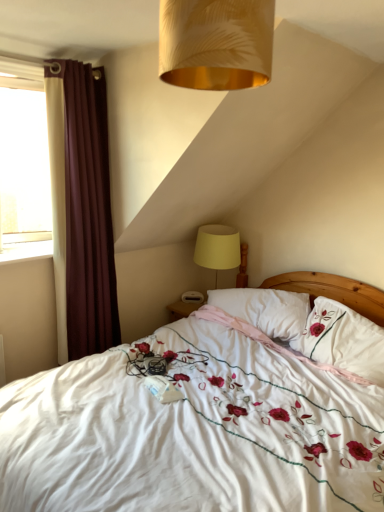
Question: From a real-world perspective, is yellow fabric lampshade at upper right positioned over white glossy window sill at left based on gravity?

Choices:
 (A) no
 (B) yes

Answer: (A)

Question: Is white glossy window sill at left surrounded by yellow fabric lampshade at upper right?

Choices:
 (A) no
 (B) yes

Answer: (A)

Question: Can you confirm if yellow fabric lampshade at upper right is thinner than white glossy window sill at left?

Choices:
 (A) no
 (B) yes

Answer: (A)

Question: Considering the relative positions of yellow fabric lampshade at upper right and white glossy window sill at left in the image provided, is yellow fabric lampshade at upper right behind white glossy window sill at left?

Choices:
 (A) no
 (B) yes

Answer: (B)

Question: Can you confirm if yellow fabric lampshade at upper right is positioned to the right of white glossy window sill at left?

Choices:
 (A) yes
 (B) no

Answer: (A)

Question: Is point (337, 397) positioned closer to the camera than point (193, 58)?

Choices:
 (A) farther
 (B) closer

Answer: (A)

Question: From the image's perspective, is white embroidered fabric at center located above or below gold textured lampshade at upper center?

Choices:
 (A) above
 (B) below

Answer: (B)

Question: Is white embroidered fabric at center to the left or to the right of gold textured lampshade at upper center in the image?

Choices:
 (A) right
 (B) left

Answer: (A)

Question: Is white embroidered fabric at center in front of or behind gold textured lampshade at upper center in the image?

Choices:
 (A) front
 (B) behind

Answer: (A)

Question: Is yellow fabric lampshade at upper right in front of or behind white soft pillow at center, acting as the 2th pillow starting from the right, in the image?

Choices:
 (A) behind
 (B) front

Answer: (A)

Question: Looking at the image, does yellow fabric lampshade at upper right seem bigger or smaller compared to white soft pillow at center, arranged as the first pillow when viewed from the left?

Choices:
 (A) big
 (B) small

Answer: (A)

Question: Looking at their shapes, would you say yellow fabric lampshade at upper right is wider or thinner than white soft pillow at center, acting as the 2th pillow starting from the right?

Choices:
 (A) thin
 (B) wide

Answer: (A)

Question: Visually, is yellow fabric lampshade at upper right positioned to the left or to the right of white soft pillow at center, arranged as the first pillow when viewed from the left?

Choices:
 (A) left
 (B) right

Answer: (A)

Question: From the image's perspective, is white glossy window sill at left located above or below white embroidered pillow at upper right, marked as the second pillow in a left-to-right arrangement?

Choices:
 (A) above
 (B) below

Answer: (A)

Question: In terms of size, does white glossy window sill at left appear bigger or smaller than white embroidered pillow at upper right, marked as the second pillow in a left-to-right arrangement?

Choices:
 (A) big
 (B) small

Answer: (B)